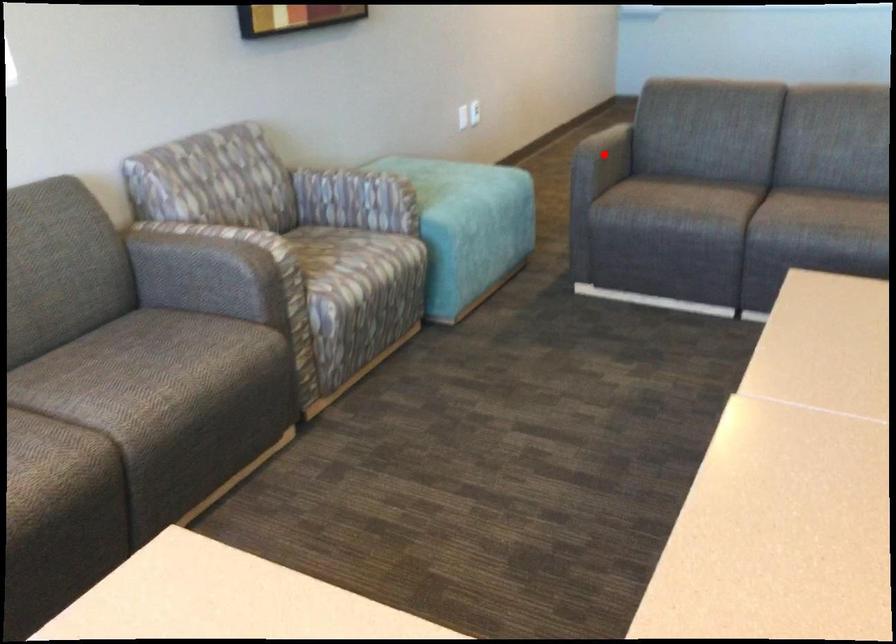
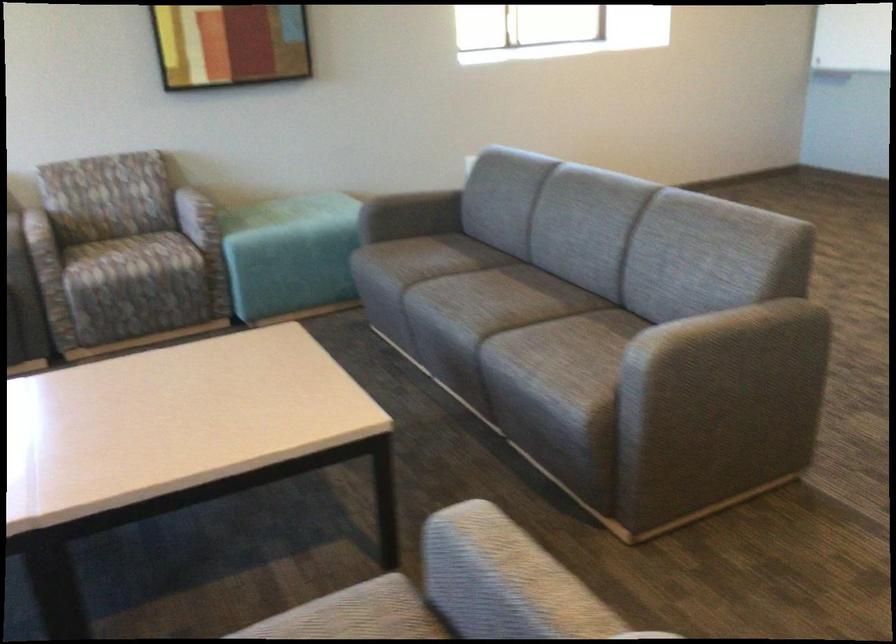
In the second image, find the point that corresponds to the highlighted location in the first image.

(411, 213)